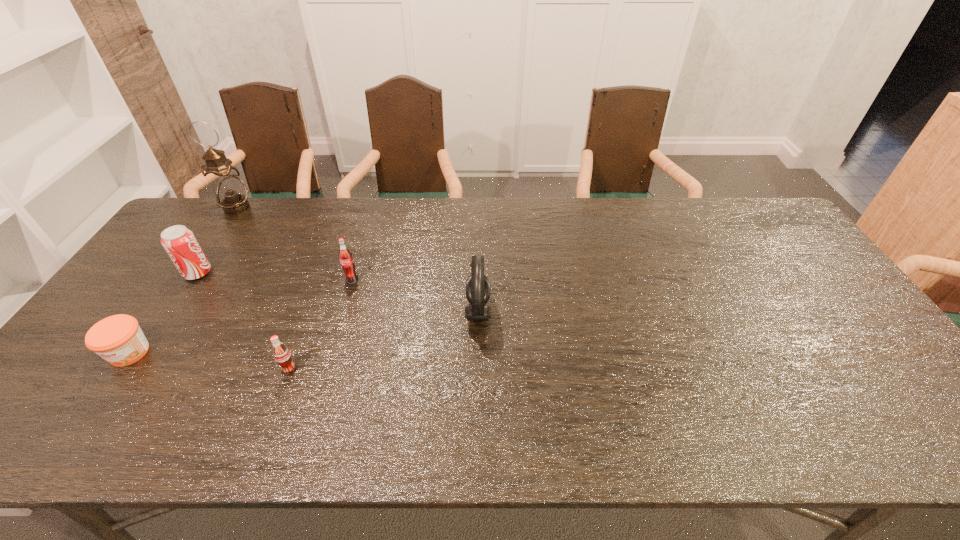
Locate an element on the screen. blank region between the leftmost soda and the shortest object is located at coordinates (163, 313).

At what (x,y) coordinates should I click in order to perform the action: click on free space that is in between the leftmost soda and the rightmost object. Please return your answer as a coordinate pair (x, y). This screenshot has width=960, height=540. Looking at the image, I should click on (338, 292).

The width and height of the screenshot is (960, 540). I want to click on vacant point located between the fifth object from left to right and the leftmost soda, so click(275, 276).

This screenshot has height=540, width=960. What are the coordinates of `unoccupied position between the shortest soda and the farthest object` in the screenshot? It's located at (263, 288).

Point out which object is positioned as the fourth nearest to the headset. Please provide its 2D coordinates. Your answer should be formatted as a tuple, i.e. [(x, y)], where the tuple contains the x and y coordinates of a point satisfying the conditions above.

[(118, 339)]

You are a GUI agent. You are given a task and a screenshot of the screen. Output one action in this format:
    pyautogui.click(x=<x>, y=<y>)
    Task: Click on the closest object relative to the tallest object
    
    Given the screenshot: What is the action you would take?
    pyautogui.click(x=179, y=242)

Identify which soda is the nearest to the headset. Please provide its 2D coordinates. Your answer should be formatted as a tuple, i.e. [(x, y)], where the tuple contains the x and y coordinates of a point satisfying the conditions above.

[(346, 259)]

Locate an element on the screen. the closest soda to the second soda from right to left is located at coordinates (346, 259).

This screenshot has width=960, height=540. I want to click on vacant position in the image that satisfies the following two spatial constraints: 1. on the logo side of the leftmost soda; 2. on the front label of the jam, so [144, 353].

Where is `vacant area in the image that satisfies the following two spatial constraints: 1. on the earcups of the headset; 2. on the front label of the jam`? Image resolution: width=960 pixels, height=540 pixels. vacant area in the image that satisfies the following two spatial constraints: 1. on the earcups of the headset; 2. on the front label of the jam is located at coordinates (478, 353).